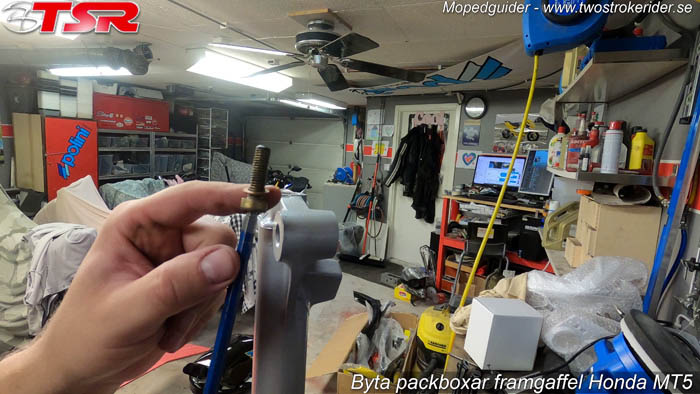
Image resolution: width=700 pixels, height=394 pixels. What are the coordinates of `light fixtures` in the screenshot? It's located at (92, 65), (265, 73), (325, 98), (308, 109).